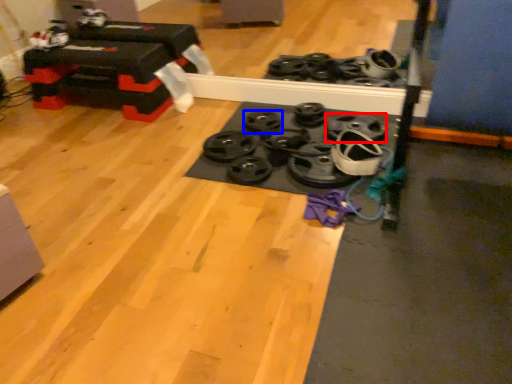
Question: Which object is closer to the camera taking this photo, wheel (highlighted by a red box) or wheel (highlighted by a blue box)?

Choices:
 (A) wheel
 (B) wheel

Answer: (A)